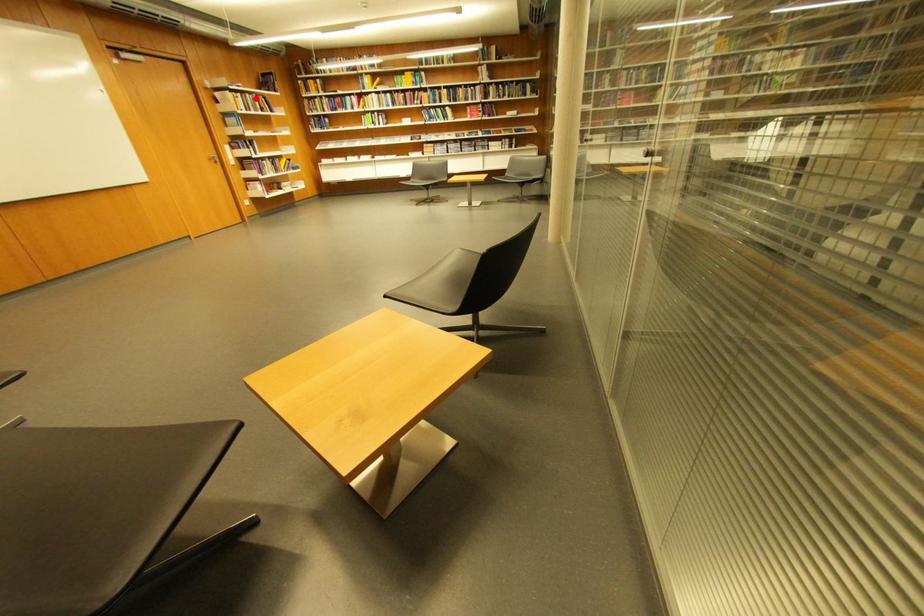
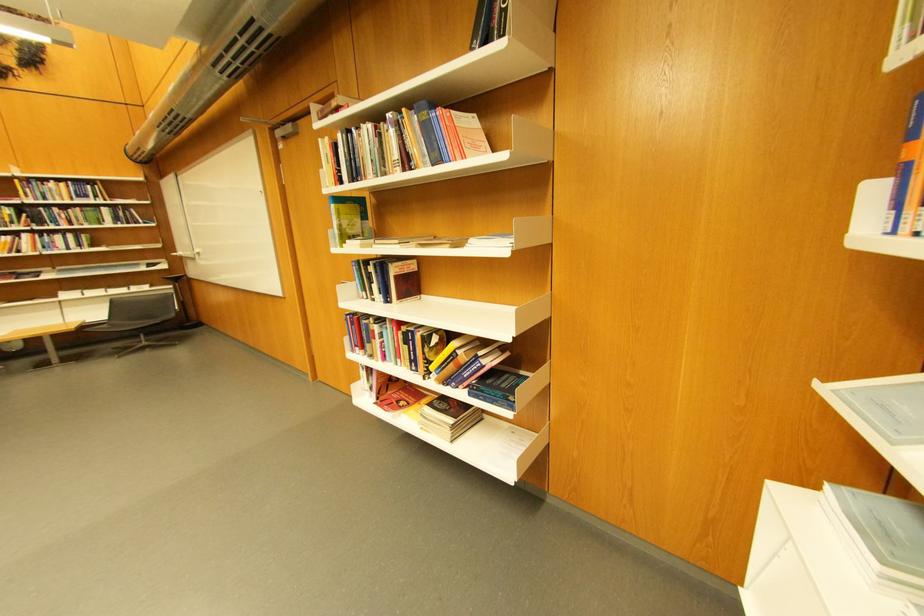
In the second image, find the point that corresponds to the highlighted location in the first image.

(370, 137)